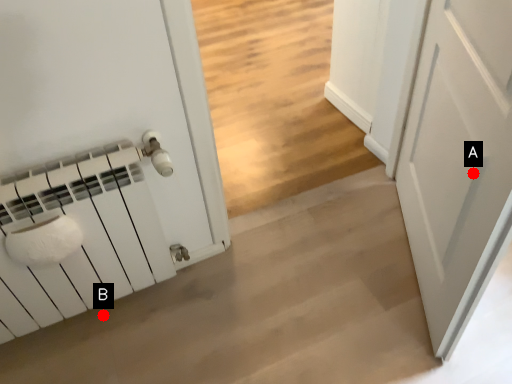
Question: Two points are circled on the image, labeled by A and B beside each circle. Which of the following is the closest to the observer?

Choices:
 (A) A is closer
 (B) B is closer

Answer: (A)